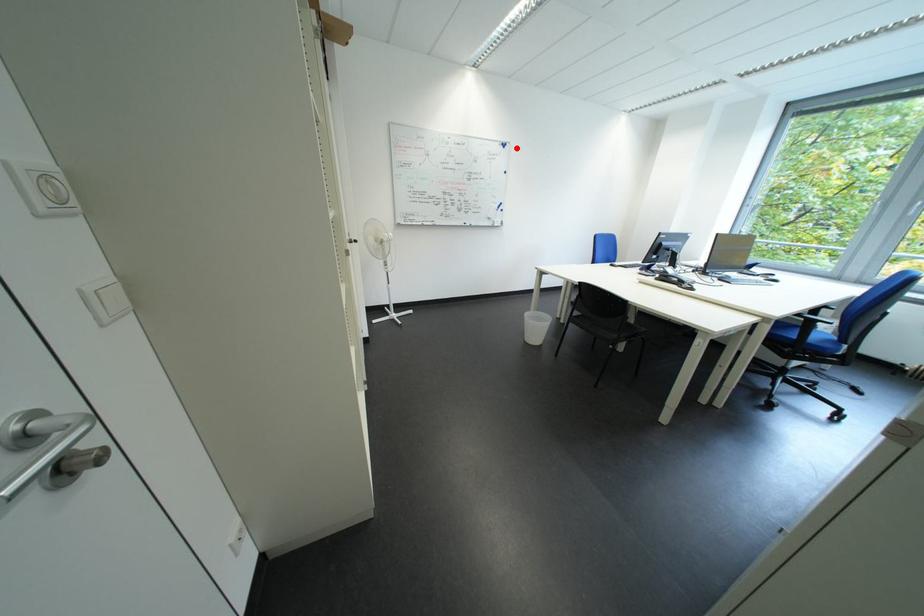
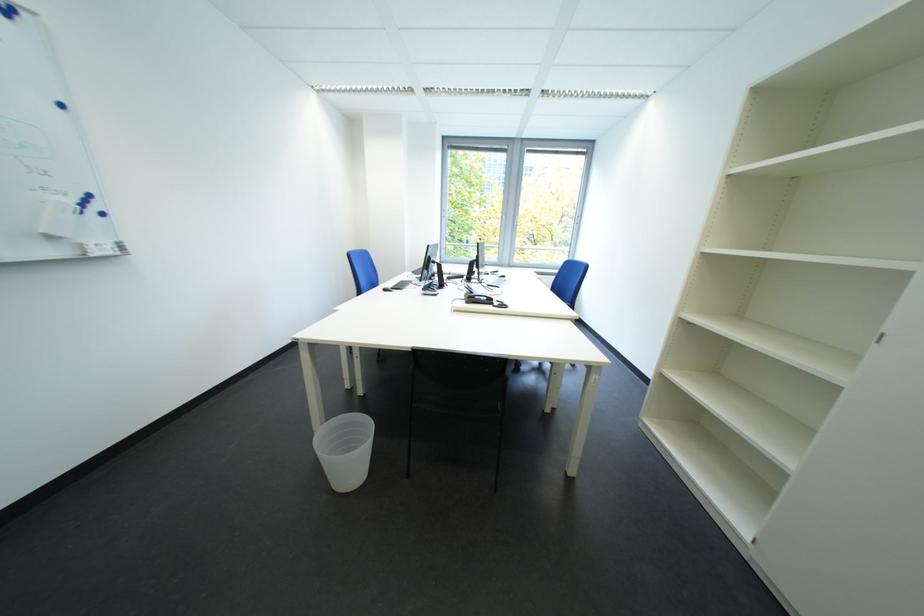
Where in the second image is the point corresponding to the highlighted location from the first image?

(17, 12)